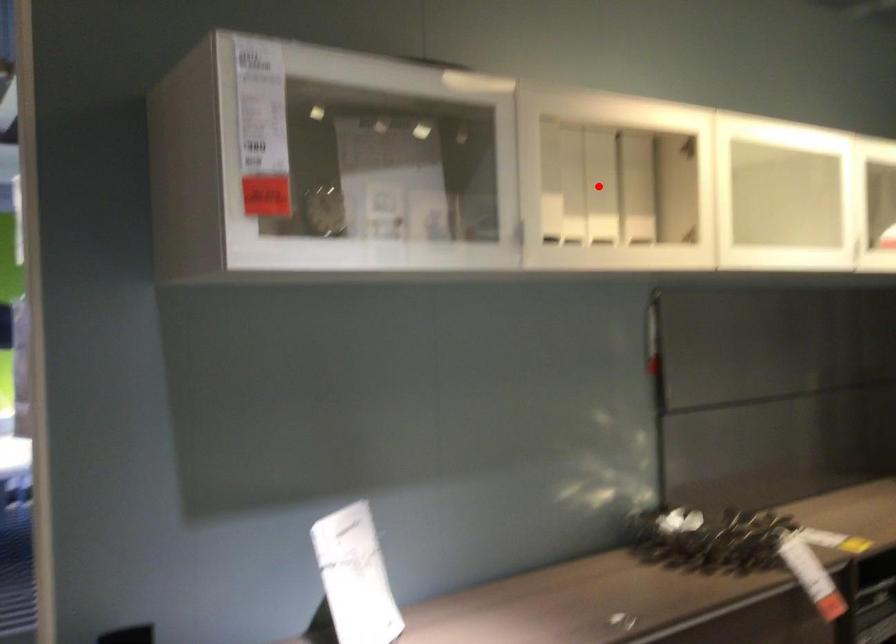
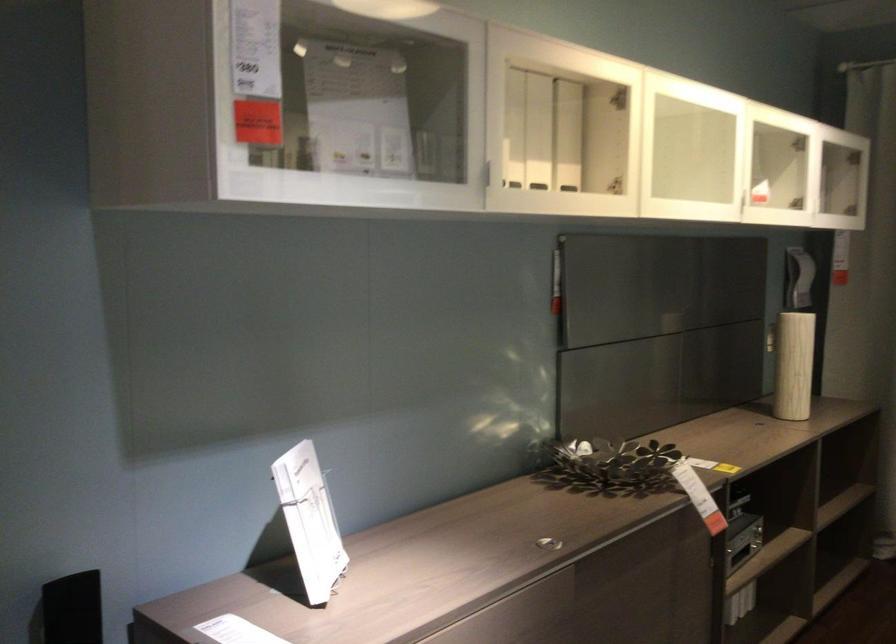
Locate, in the second image, the point that corresponds to the highlighted location in the first image.

(538, 131)